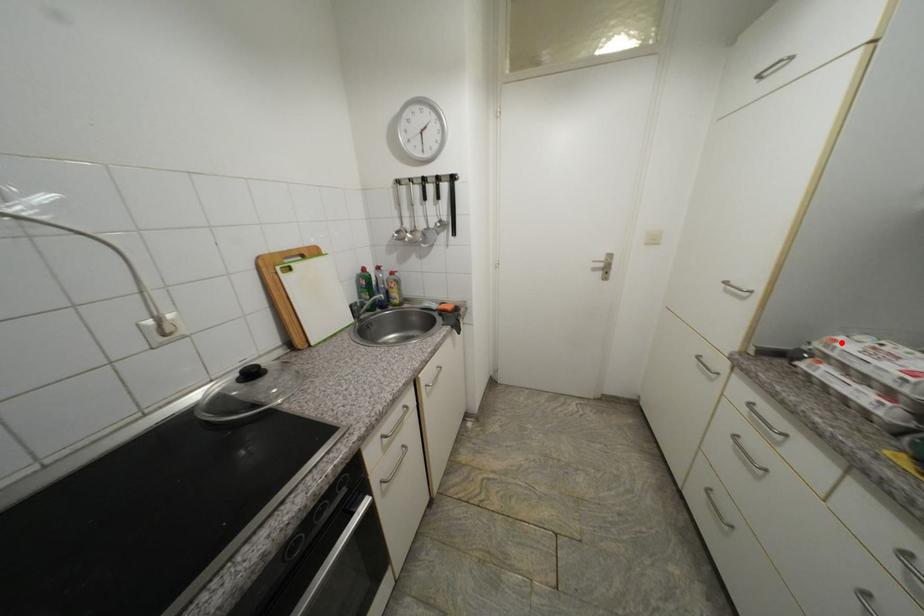
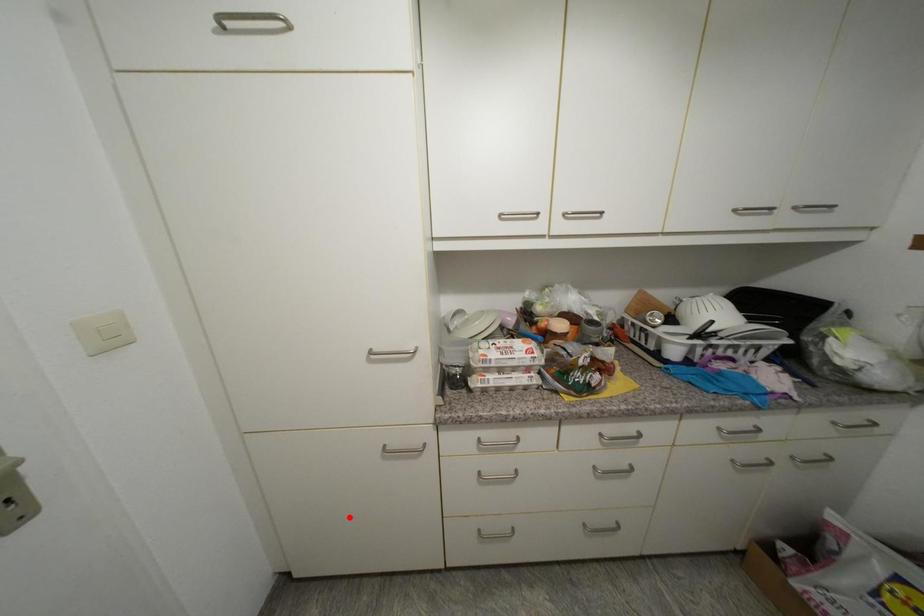
I am providing you with two images of the same scene from different viewpoints. A red point is marked on the first image and another point is marked on the second image. Does the point marked in image1 correspond to the same location as the one in image2?

No